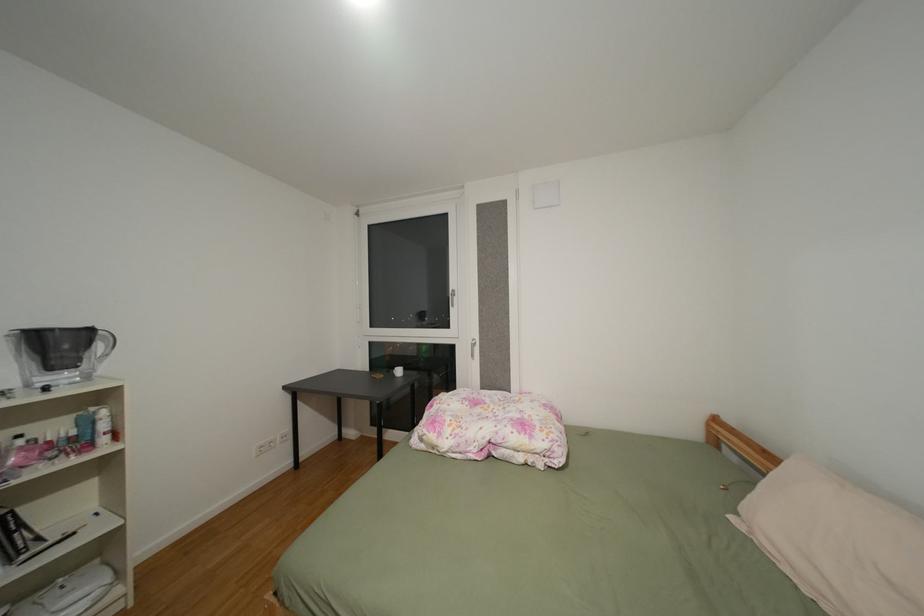
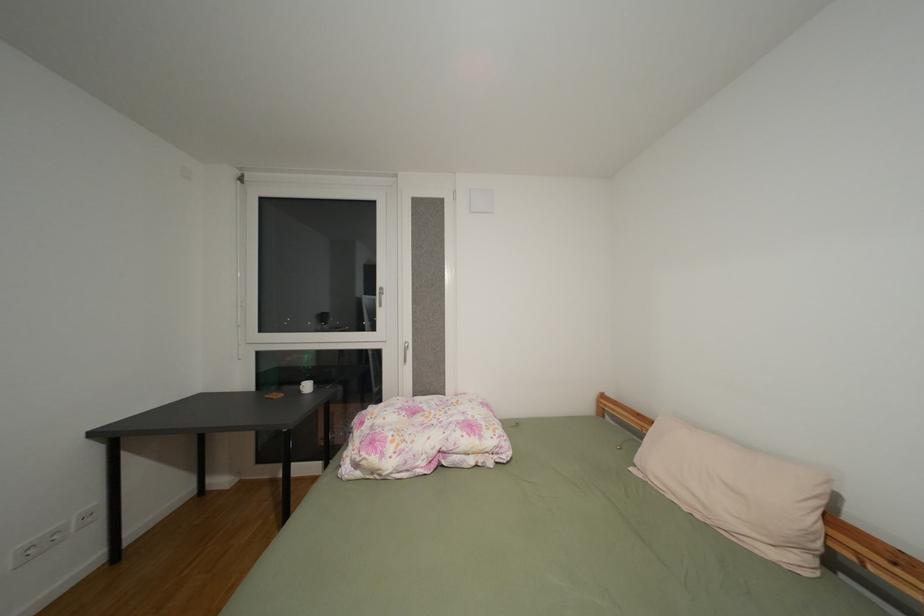
Which direction would the cameraman need to move to produce the second image?

The cameraman moved toward left, forward.